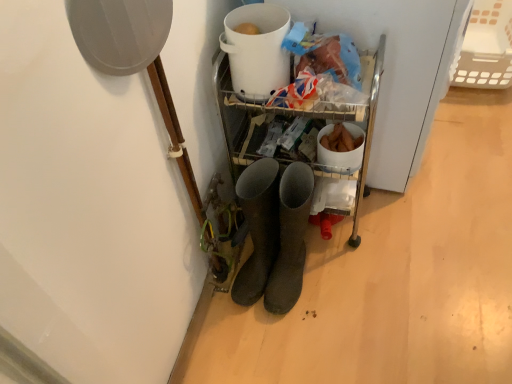
At what (x,y) coordinates should I click in order to perform the action: click on free space to the left of dark gray rubber boots at center. Please return your answer as a coordinate pair (x, y). The height and width of the screenshot is (384, 512). Looking at the image, I should click on (232, 319).